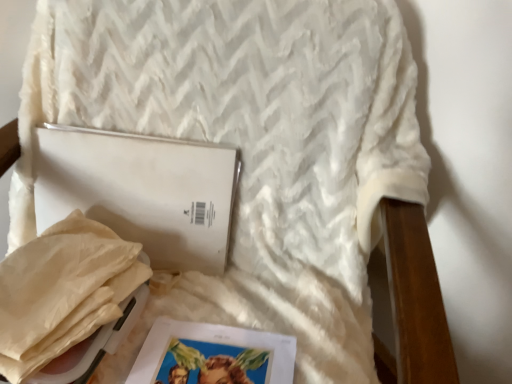
Describe the element at coordinates (62, 291) in the screenshot. I see `beige paper bag at lower left` at that location.

Locate an element on the screen. The image size is (512, 384). white matte journal at center is located at coordinates (141, 191).

Describe the element at coordinates (141, 191) in the screenshot. I see `white matte journal at center` at that location.

I want to click on beige paper bag at lower left, so click(62, 291).

Is matte paper magazine at lower center wider or thinner than beige paper bag at lower left?

Considering their sizes, matte paper magazine at lower center looks broader than beige paper bag at lower left.

Can you see matte paper magazine at lower center touching beige paper bag at lower left?

matte paper magazine at lower center is not next to beige paper bag at lower left, and they're not touching.

Based on the photo, is matte paper magazine at lower center oriented towards beige paper bag at lower left?

No, matte paper magazine at lower center is not aimed at beige paper bag at lower left.

Which point is more forward, (279, 372) or (88, 243)?

The point (279, 372) is more forward.

Find the location of a particular element. Image resolution: width=512 pixels, height=384 pixels. journal on the right side of beige paper bag at lower left is located at coordinates (141, 191).

Is white matte journal at center at the left side of beige paper bag at lower left?

No.

From the image's perspective, which is below, white matte journal at center or beige paper bag at lower left?

beige paper bag at lower left, from the image's perspective.

Is the depth of white matte journal at center greater than that of beige paper bag at lower left?

Yes, white matte journal at center is further from the viewer.

Is beige paper bag at lower left closer to camera compared to white matte journal at center?

Yes.

Would you consider beige paper bag at lower left to be distant from white matte journal at center?

No.

Is point (74, 236) positioned after point (97, 207)?

No, (74, 236) is in front of (97, 207).

From the image's perspective, is beige paper bag at lower left positioned above or below white matte journal at center?

beige paper bag at lower left is below white matte journal at center.

From a real-world perspective, which object rests below the other?

From a 3D spatial view, matte paper magazine at lower center is below.

Considering the sizes of objects matte paper magazine at lower center and white matte journal at center in the image provided, who is shorter, matte paper magazine at lower center or white matte journal at center?

With less height is matte paper magazine at lower center.

From the image's perspective, which one is positioned lower, matte paper magazine at lower center or white matte journal at center?

matte paper magazine at lower center appears lower in the image.

Can you confirm if white matte journal at center is positioned to the right of matte paper magazine at lower center?

No, white matte journal at center is not to the right of matte paper magazine at lower center.

From the image's perspective, which one is positioned higher, white matte journal at center or matte paper magazine at lower center?

white matte journal at center, from the image's perspective.

From a real-world perspective, which is physically above, white matte journal at center or matte paper magazine at lower center?

white matte journal at center.

Is white matte journal at center next to matte paper magazine at lower center?

No, white matte journal at center is not in contact with matte paper magazine at lower center.

From the image's perspective, which is below, beige paper bag at lower left or matte paper magazine at lower center?

matte paper magazine at lower center.

Considering the positions of objects beige paper bag at lower left and matte paper magazine at lower center in the image provided, who is more to the left, beige paper bag at lower left or matte paper magazine at lower center?

From the viewer's perspective, beige paper bag at lower left appears more on the left side.

Based on the photo, would you say beige paper bag at lower left is inside or outside matte paper magazine at lower center?

beige paper bag at lower left is located beyond the bounds of matte paper magazine at lower center.

Where is `material above the matte paper magazine at lower center (from a real-world perspective)`? material above the matte paper magazine at lower center (from a real-world perspective) is located at coordinates (62, 291).

This screenshot has height=384, width=512. I want to click on material below the white matte journal at center (from the image's perspective), so click(x=62, y=291).

Looking at this image, from the image, which object appears to be nearer to beige paper bag at lower left, matte paper magazine at lower center or white matte journal at center?

white matte journal at center lies closer to beige paper bag at lower left than the other object.

Looking at this image, which object lies further to the anchor point white matte journal at center, beige paper bag at lower left or matte paper magazine at lower center?

Based on the image, matte paper magazine at lower center appears to be further to white matte journal at center.

Looking at this image, looking at the image, which one is located further to matte paper magazine at lower center, white matte journal at center or beige paper bag at lower left?

white matte journal at center is positioned further to the anchor matte paper magazine at lower center.

Estimate the real-world distances between objects in this image. Which object is further from beige paper bag at lower left, white matte journal at center or matte paper magazine at lower center?

matte paper magazine at lower center.

Based on their spatial positions, is beige paper bag at lower left or white matte journal at center further from matte paper magazine at lower center?

Among the two, white matte journal at center is located further to matte paper magazine at lower center.

From the image, which object appears to be farther from white matte journal at center, matte paper magazine at lower center or beige paper bag at lower left?

Based on the image, matte paper magazine at lower center appears to be further to white matte journal at center.

The width and height of the screenshot is (512, 384). I want to click on material between white matte journal at center and matte paper magazine at lower center from top to bottom, so click(x=62, y=291).